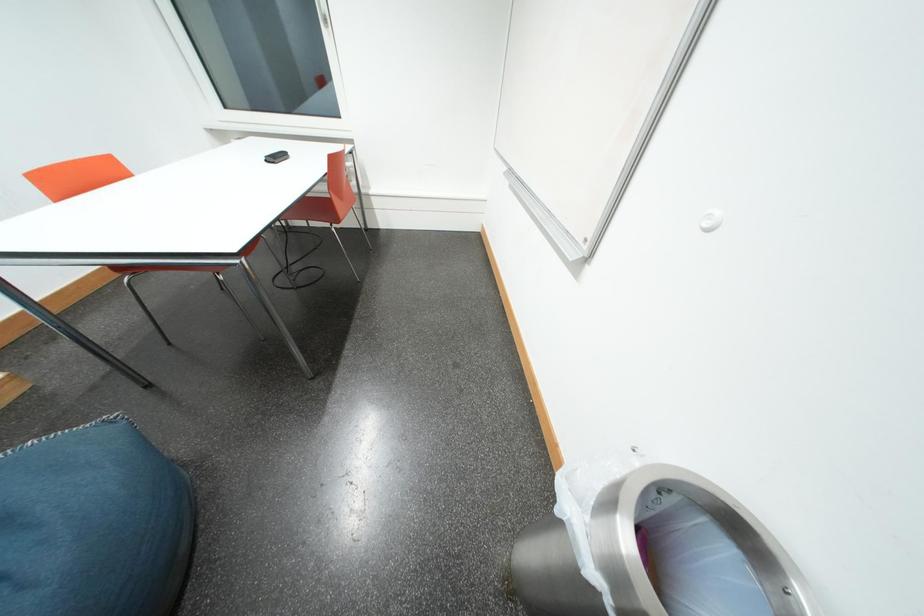
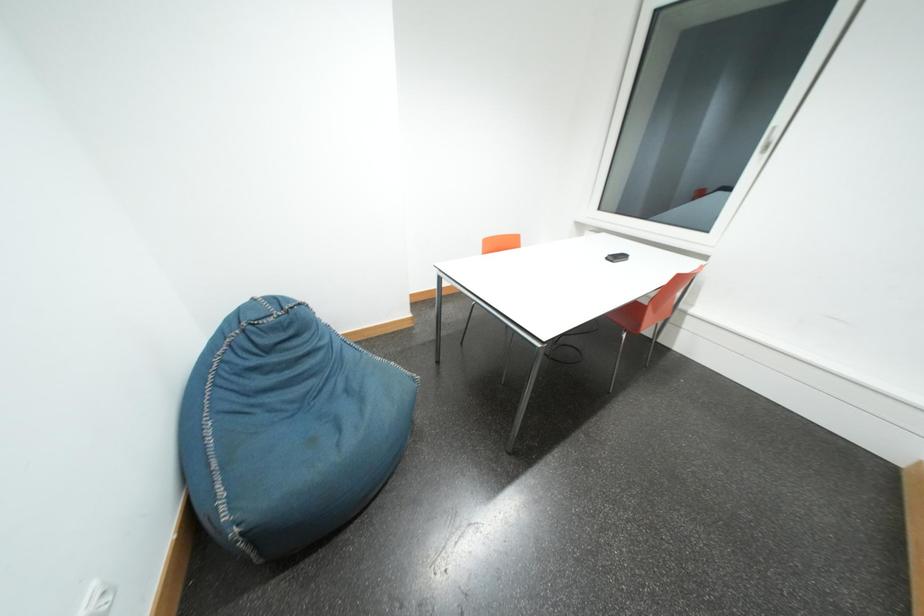
Question: The camera is either moving clockwise (left) or counter-clockwise (right) around the object. The first image is from the beginning of the video and the second image is from the end. Is the camera moving left or right when shooting the video?

Choices:
 (A) Left
 (B) Right

Answer: (B)